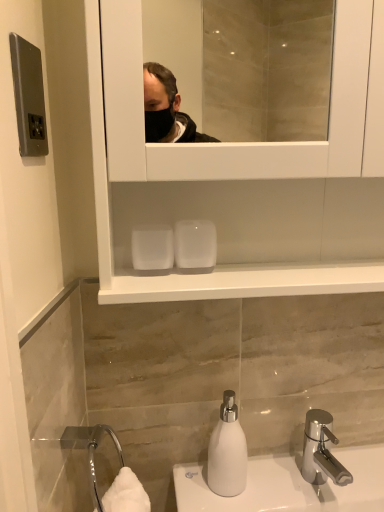
Question: Considering the relative positions of white matte soap dispenser at lower center and polished chrome faucet at lower right in the image provided, is white matte soap dispenser at lower center to the right of polished chrome faucet at lower right from the viewer's perspective?

Choices:
 (A) yes
 (B) no

Answer: (B)

Question: Can you confirm if white matte soap dispenser at lower center is thinner than polished chrome faucet at lower right?

Choices:
 (A) no
 (B) yes

Answer: (B)

Question: Considering the relative sizes of white matte soap dispenser at lower center and polished chrome faucet at lower right in the image provided, is white matte soap dispenser at lower center bigger than polished chrome faucet at lower right?

Choices:
 (A) yes
 (B) no

Answer: (B)

Question: Considering the relative sizes of white matte soap dispenser at lower center and polished chrome faucet at lower right in the image provided, is white matte soap dispenser at lower center smaller than polished chrome faucet at lower right?

Choices:
 (A) yes
 (B) no

Answer: (A)

Question: Can polished chrome faucet at lower right be found inside white matte soap dispenser at lower center?

Choices:
 (A) yes
 (B) no

Answer: (B)

Question: Is white matte soap dispenser at lower center positioned far away from polished chrome faucet at lower right?

Choices:
 (A) yes
 (B) no

Answer: (B)

Question: Is polished chrome faucet at lower right not within white matte soap dispenser at lower center?

Choices:
 (A) yes
 (B) no

Answer: (A)

Question: Is polished chrome faucet at lower right at the left side of white matte soap dispenser at lower center?

Choices:
 (A) no
 (B) yes

Answer: (A)

Question: From a real-world perspective, is polished chrome faucet at lower right located beneath white matte soap dispenser at lower center?

Choices:
 (A) no
 (B) yes

Answer: (B)

Question: Is polished chrome faucet at lower right positioned in front of white matte soap dispenser at lower center?

Choices:
 (A) yes
 (B) no

Answer: (A)

Question: Considering the relative sizes of polished chrome faucet at lower right and white matte soap dispenser at lower center in the image provided, is polished chrome faucet at lower right taller than white matte soap dispenser at lower center?

Choices:
 (A) yes
 (B) no

Answer: (B)

Question: Are polished chrome faucet at lower right and white matte soap dispenser at lower center located far from each other?

Choices:
 (A) yes
 (B) no

Answer: (B)

Question: Considering the positions of point (238, 474) and point (306, 437), is point (238, 474) closer or farther from the camera than point (306, 437)?

Choices:
 (A) farther
 (B) closer

Answer: (B)